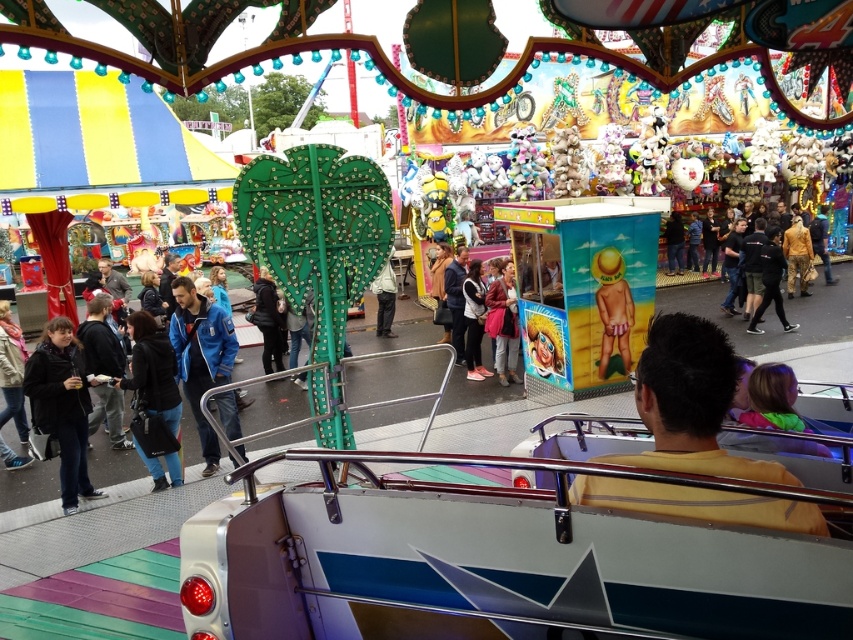
Which is more to the right, yellow matte shirt at center or leather jacket at center?

yellow matte shirt at center is more to the right.

Between yellow matte shirt at center and leather jacket at center, which one has more height?

leather jacket at center is taller.

Who is more forward, (740, 460) or (498, 296)?

Point (740, 460) is in front.

Where is `yellow matte shirt at center`? Image resolution: width=853 pixels, height=640 pixels. yellow matte shirt at center is located at coordinates (689, 403).

Does black leather jacket at lower left appear under leather jacket at center?

Yes, black leather jacket at lower left is below leather jacket at center.

Image resolution: width=853 pixels, height=640 pixels. Identify the location of black leather jacket at lower left. (152, 371).

Based on the photo, can you confirm if black matte jacket at lower left is wider than black leather jacket at lower left?

No, black matte jacket at lower left is not wider than black leather jacket at lower left.

Measure the distance between black matte jacket at lower left and black leather jacket at lower left.

black matte jacket at lower left is 89.15 centimeters from black leather jacket at lower left.

Does point (44, 364) come farther from viewer compared to point (160, 412)?

No, (44, 364) is in front of (160, 412).

Locate an element on the screen. black matte jacket at lower left is located at coordinates (62, 404).